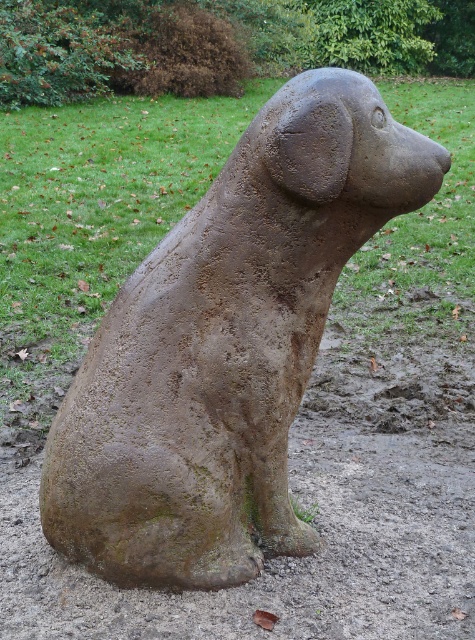
Looking at this image, you are an artist planning to create a miniature version of the statue scene. You have two statues in the scene, the rusty stone dog at center and the brown textured dog at center. Which one should you scale down more to maintain the original spatial proportions?

The rusty stone dog at center occupies less space than the brown textured dog at center, so you should scale down the brown textured dog at center more to maintain the original spatial proportions.

You are a gardener who wants to place a new flower pot between the rusty stone dog at center and the brown textured dog at center. The flower pot requires 3 feet of space. Can you fit it there?

The rusty stone dog at center and the brown textured dog at center are 37.41 inches apart from each other. Since 37.41 inches is approximately 3.12 feet, which is slightly more than the required 3 feet, the flower pot can fit between them.

You are an art student analyzing the statue of a dog in the image. The scene shows a rusty stone dog at center and a brown textured dog at center. Which of these two dogs has a more slender appearance?

The rusty stone dog at center is thinner than the brown textured dog at center, so it has a more slender appearance.